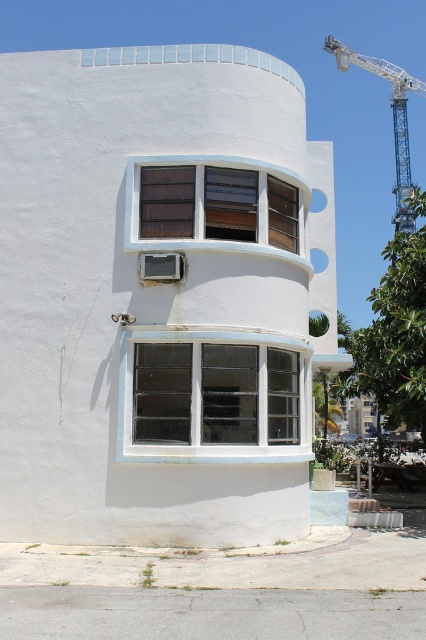
Is white textured glass window at center shorter than brown wood window at center?

Incorrect, white textured glass window at center's height does not fall short of brown wood window at center's.

Can you confirm if white textured glass window at center is positioned to the right of brown wood window at center?

In fact, white textured glass window at center is to the left of brown wood window at center.

Is point (293, 410) closer to camera compared to point (195, 241)?

No, (293, 410) is further to viewer.

This screenshot has height=640, width=426. What are the coordinates of `white textured glass window at center` in the screenshot? It's located at (206, 397).

Is point (236, 445) farther from camera compared to point (406, 188)?

That is False.

Can you confirm if white textured glass window at center is bigger than blue metallic crane at upper right?

No.

Does point (187, 442) come closer to viewer compared to point (408, 166)?

That is True.

I want to click on white textured glass window at center, so click(x=206, y=397).

Can you confirm if brown wood window at center is smaller than blue metallic crane at upper right?

Correct, brown wood window at center occupies less space than blue metallic crane at upper right.

Can you confirm if brown wood window at center is positioned to the right of blue metallic crane at upper right?

No, brown wood window at center is not to the right of blue metallic crane at upper right.

I want to click on brown wood window at center, so click(206, 205).